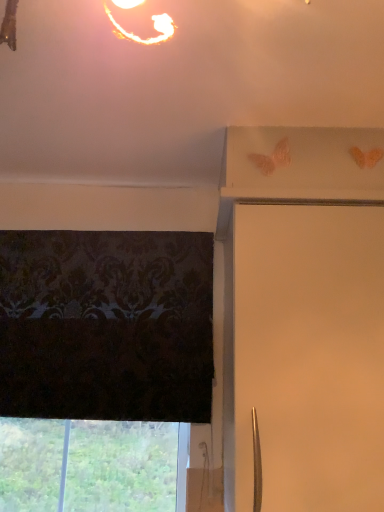
Question: In terms of size, does white matte shutter at upper right appear bigger or smaller than transparent glass window at lower left?

Choices:
 (A) small
 (B) big

Answer: (B)

Question: Considering their positions, is white matte shutter at upper right located in front of or behind transparent glass window at lower left?

Choices:
 (A) behind
 (B) front

Answer: (B)

Question: Based on their positions, is white matte shutter at upper right located to the left or right of transparent glass window at lower left?

Choices:
 (A) right
 (B) left

Answer: (A)

Question: Is point (33, 492) closer or farther from the camera than point (360, 393)?

Choices:
 (A) closer
 (B) farther

Answer: (B)

Question: From the image's perspective, is transparent glass window at lower left positioned above or below white matte shutter at upper right?

Choices:
 (A) above
 (B) below

Answer: (B)

Question: From a real-world perspective, is transparent glass window at lower left physically located above or below white matte shutter at upper right?

Choices:
 (A) below
 (B) above

Answer: (A)

Question: Is transparent glass window at lower left wider or thinner than white matte shutter at upper right?

Choices:
 (A) thin
 (B) wide

Answer: (A)